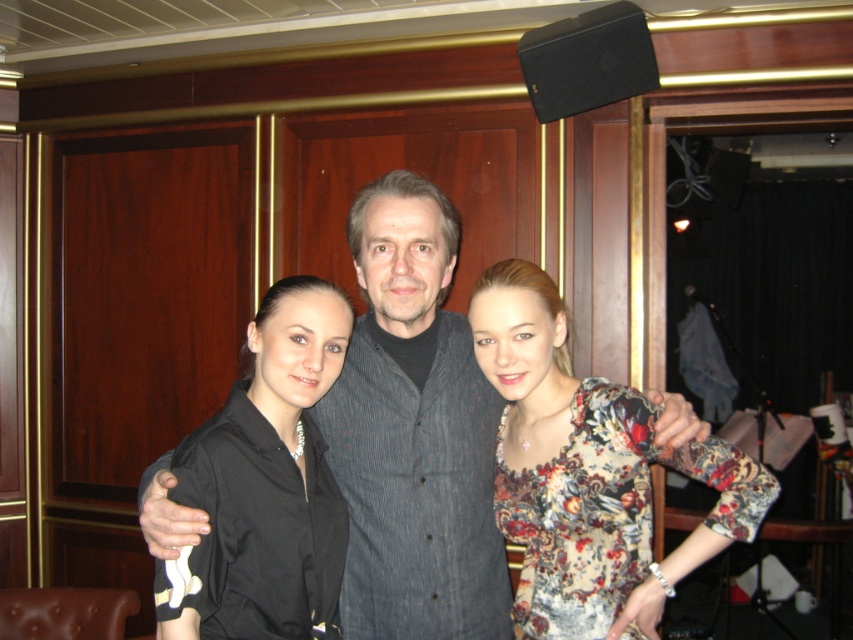
Is floral print blouse at center shorter than black satin blouse at center?

Incorrect, floral print blouse at center's height does not fall short of black satin blouse at center's.

Between point (532, 412) and point (335, 632), which one is positioned in front?

Point (335, 632) is in front.

The width and height of the screenshot is (853, 640). Find the location of `floral print blouse at center`. floral print blouse at center is located at coordinates (587, 472).

Is point (361, 506) positioned behind point (306, 481)?

Yes, point (361, 506) is farther from viewer.

Identify the location of dark gray textured shirt at center. The width and height of the screenshot is (853, 640). (413, 432).

Identify the location of dark gray textured shirt at center. (413, 432).

Is dark gray textured shirt at center thinner than floral print blouse at center?

Yes, dark gray textured shirt at center is thinner than floral print blouse at center.

Locate an element on the screen. Image resolution: width=853 pixels, height=640 pixels. dark gray textured shirt at center is located at coordinates (413, 432).

Where is `dark gray textured shirt at center`? This screenshot has height=640, width=853. dark gray textured shirt at center is located at coordinates (413, 432).